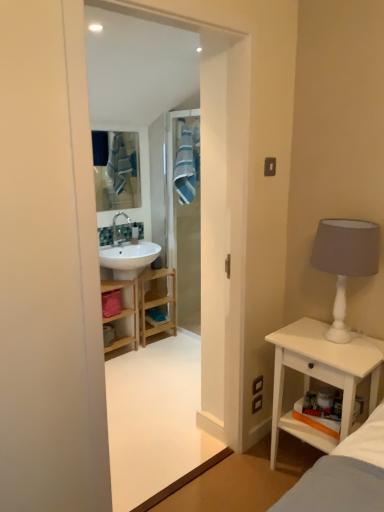
I want to click on vacant region in front of white matte table lamp at right, so click(348, 358).